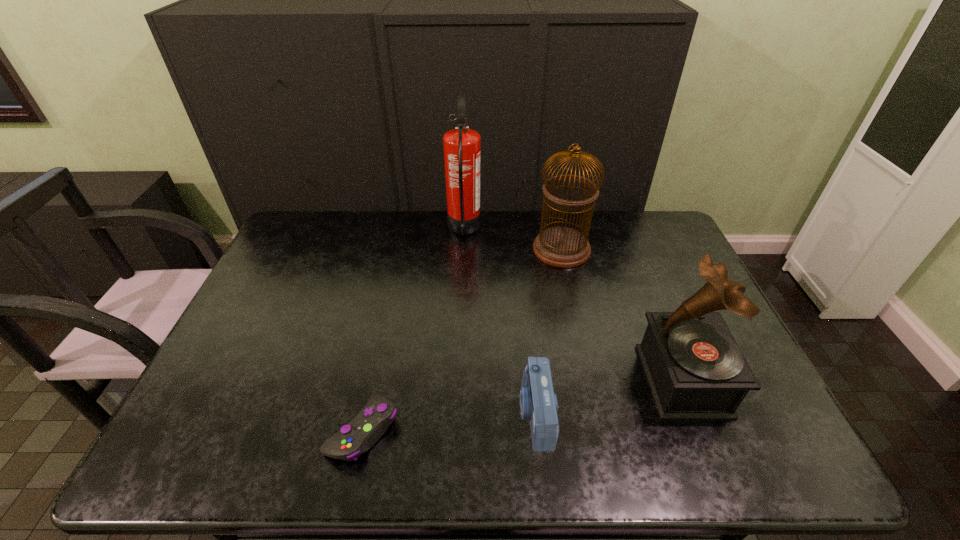
You are a GUI agent. You are given a task and a screenshot of the screen. Output one action in this format:
    pyautogui.click(x=<x>, y=<y>)
    Task: Click on the free spot between the rightmost object and the second shortest object
    Image resolution: width=960 pixels, height=540 pixels.
    Given the screenshot: What is the action you would take?
    pyautogui.click(x=609, y=397)

Where is `vacant space in between the fourth object from left to right and the fourth object from right to left`? Image resolution: width=960 pixels, height=540 pixels. vacant space in between the fourth object from left to right and the fourth object from right to left is located at coordinates [513, 239].

You are a GUI agent. You are given a task and a screenshot of the screen. Output one action in this format:
    pyautogui.click(x=<x>, y=<y>)
    Task: Click on the vacant point located between the birdcage and the third object from left to right
    
    Given the screenshot: What is the action you would take?
    [x=548, y=331]

At what (x,y) coordinates should I click in order to perform the action: click on unoccupied area between the leftmost object and the third object from left to right. Please return your answer as a coordinate pair (x, y). This screenshot has height=540, width=960. Looking at the image, I should click on (449, 422).

Locate an element on the screen. The height and width of the screenshot is (540, 960). empty space between the fire extinguisher and the rightmost object is located at coordinates (573, 305).

Select which object is the closest to the third object from right to left. Please provide its 2D coordinates. Your answer should be formatted as a tuple, i.e. [(x, y)], where the tuple contains the x and y coordinates of a point satisfying the conditions above.

[(695, 370)]

At what (x,y) coordinates should I click in order to perform the action: click on object that stands as the closest to the camera. Please return your answer as a coordinate pair (x, y). Looking at the image, I should click on (695, 370).

This screenshot has height=540, width=960. I want to click on free space that satisfies the following two spatial constraints: 1. on the front-facing side of the second object from left to right; 2. on the front side of the control, so click(x=455, y=430).